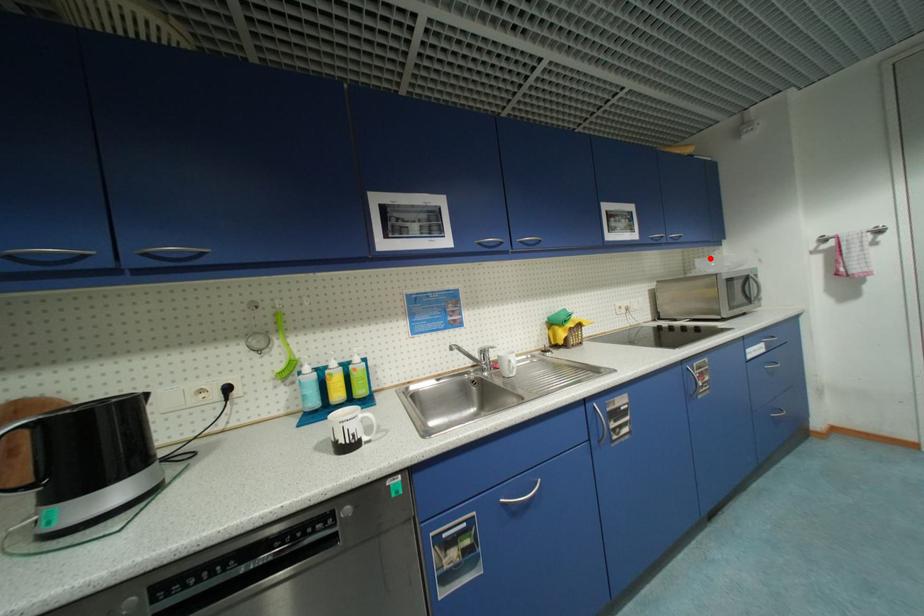
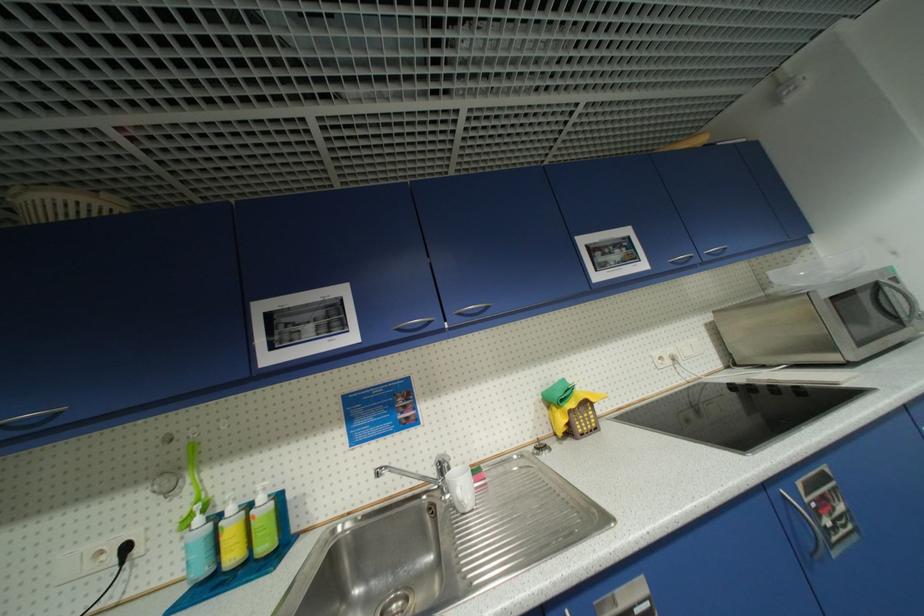
Question: I am providing you with two images of the same scene from different viewpoints. A red point is marked on the first image. Is the red point's position out of view in image 2?

Choices:
 (A) Yes
 (B) No

Answer: (B)